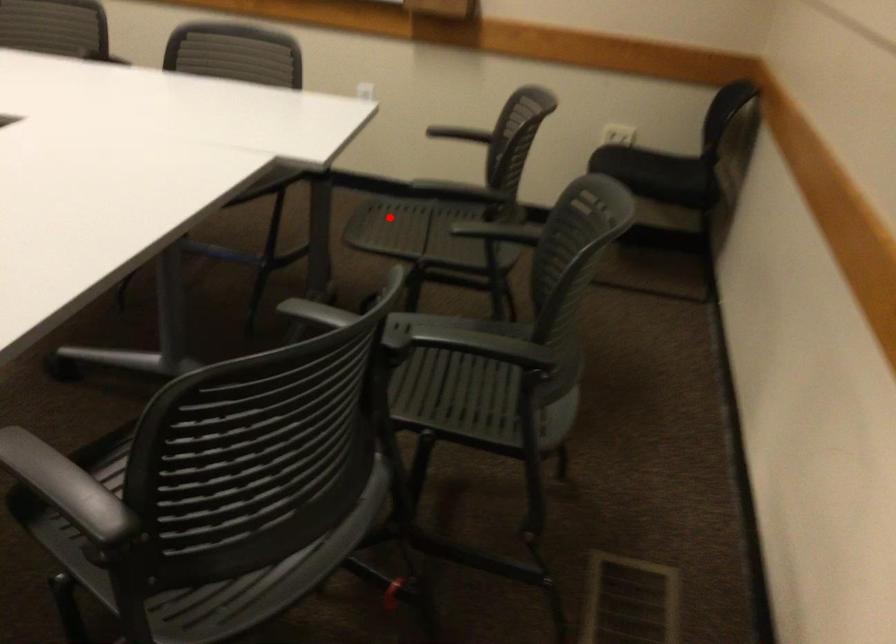
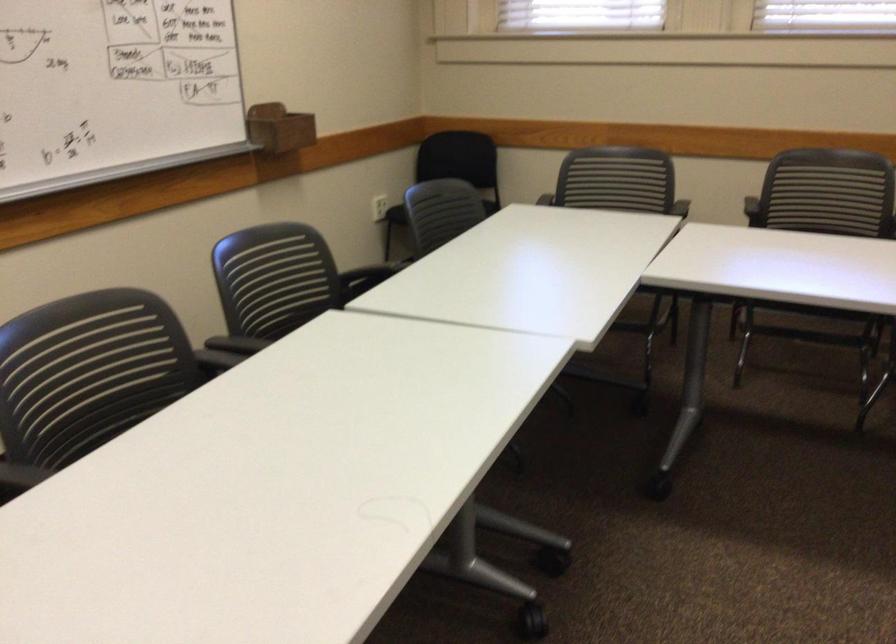
Question: I am providing you with two images of the same scene from different viewpoints. A red point is marked on the first image. Is the red point's position out of view in image 2?

Choices:
 (A) Yes
 (B) No

Answer: (A)